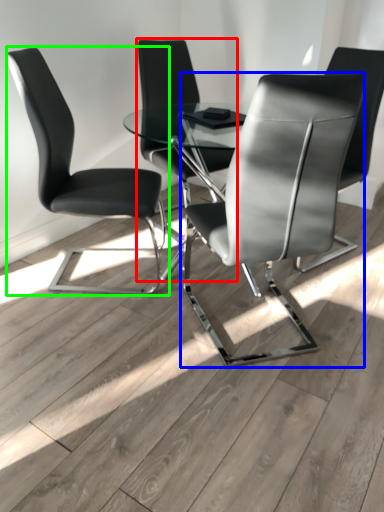
Question: Based on their relative distances, which object is farther from chair (highlighted by a red box)? Choose from chair (highlighted by a blue box) and chair (highlighted by a green box).

Choices:
 (A) chair
 (B) chair

Answer: (A)